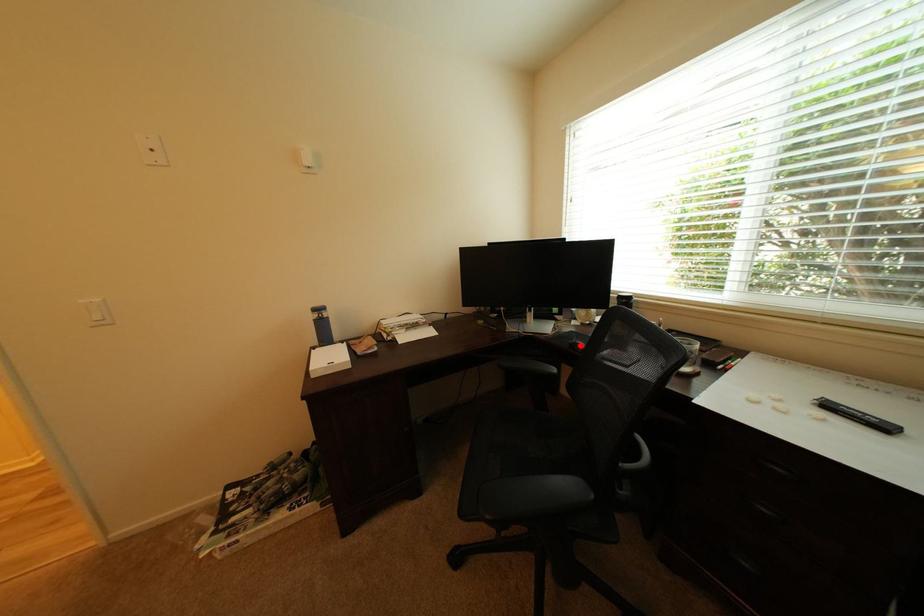
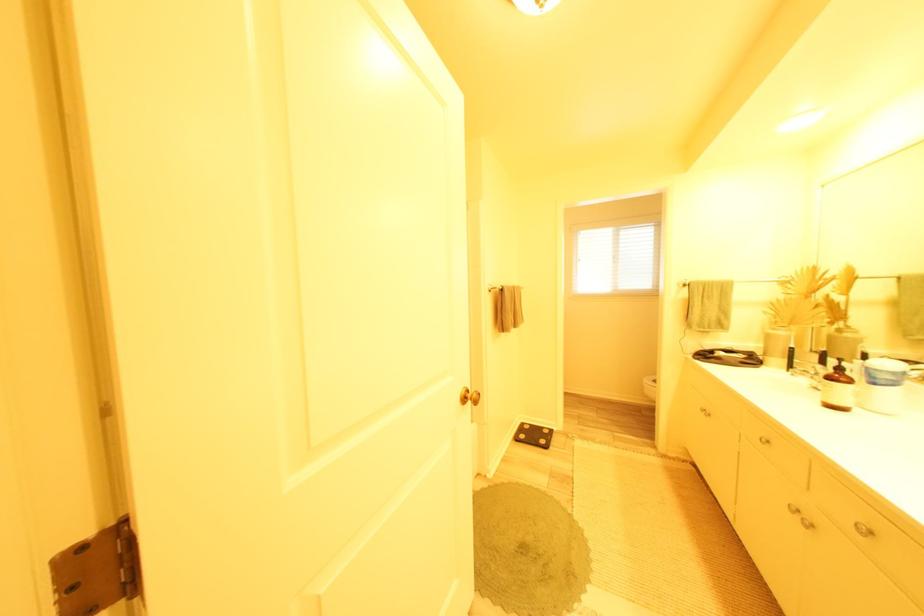
Question: I am providing you with two images of the same scene from different viewpoints. A red point is marked on the first image. At the location where the point appears in image 1, is it still visible in image 2?

Choices:
 (A) Yes
 (B) No

Answer: (B)